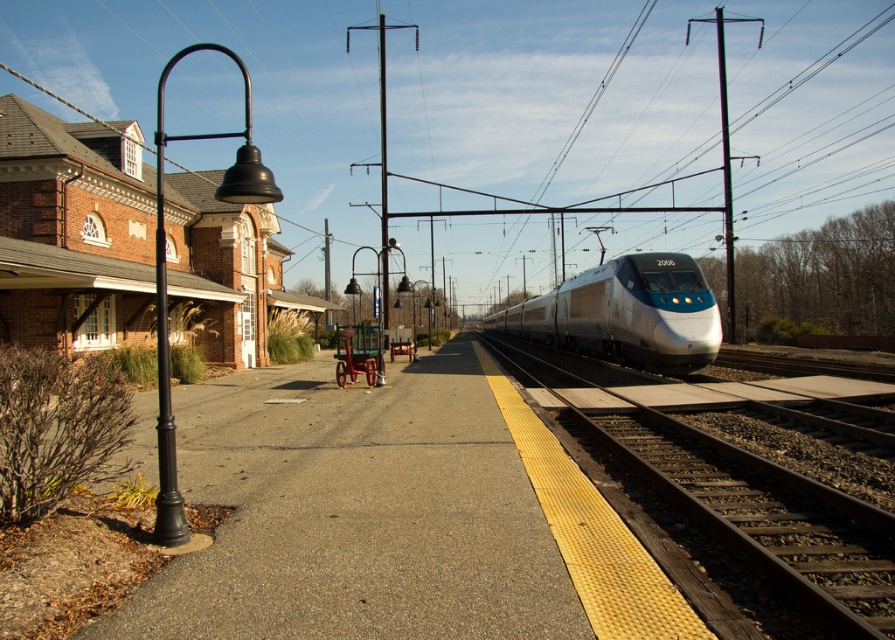
You are standing at the platform edge near the yellow tactile paving strip. You see a point marked at coordinates point (x=736, y=513). Where is this point located relative to the metallic gray train track at center?

The point (x=736, y=513) is located on the metallic gray train track at center.

You are a passenger waiting at the train station. You see a silver metallic train at center and a metallic pole at right. Which object is closer to the edge of the platform?

The silver metallic train at center is positioned on the left side of metallic pole at right, so the metallic pole at right is closer to the edge of the platform.